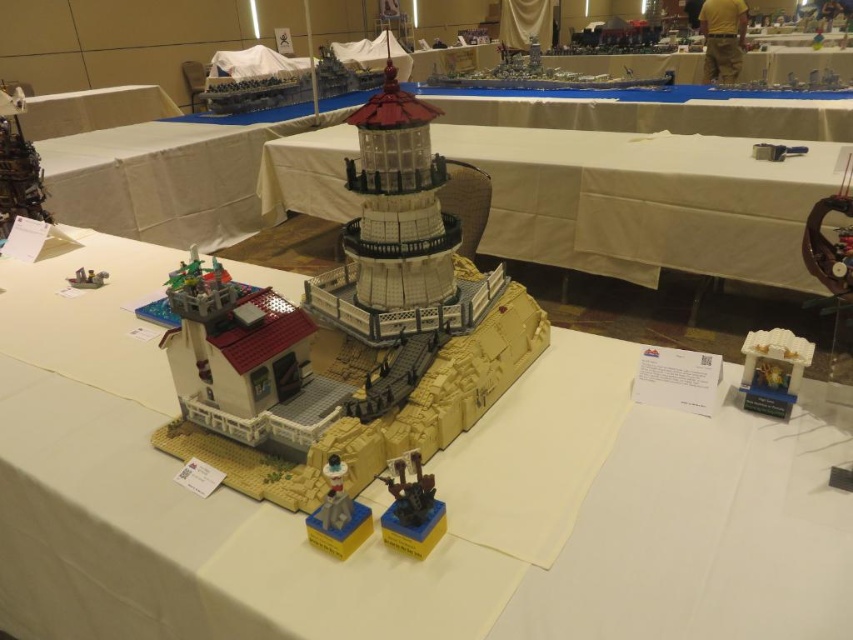
Which is in front, point (703, 141) or point (64, 93)?

Point (703, 141) is more forward.

Which is behind, point (641, 198) or point (90, 120)?

The point (90, 120) is behind.

I want to click on white fabric at center, so click(x=646, y=202).

Does white matte lego lighthouse at center appear on the right side of white fabric table at upper left?

Correct, you'll find white matte lego lighthouse at center to the right of white fabric table at upper left.

Is white matte lego lighthouse at center to the left of white fabric table at upper left from the viewer's perspective?

No, white matte lego lighthouse at center is not to the left of white fabric table at upper left.

The image size is (853, 640). What do you see at coordinates (437, 493) in the screenshot? I see `white matte lego lighthouse at center` at bounding box center [437, 493].

Identify the location of white matte lego lighthouse at center. This screenshot has width=853, height=640. (437, 493).

Does brick-like lego lighthouse at center have a greater width compared to white fabric table at upper left?

No.

Is brick-like lego lighthouse at center further to the viewer compared to white fabric table at upper left?

That is False.

Does point (254, 420) come behind point (134, 108)?

That is False.

Image resolution: width=853 pixels, height=640 pixels. I want to click on brick-like lego lighthouse at center, so click(x=352, y=333).